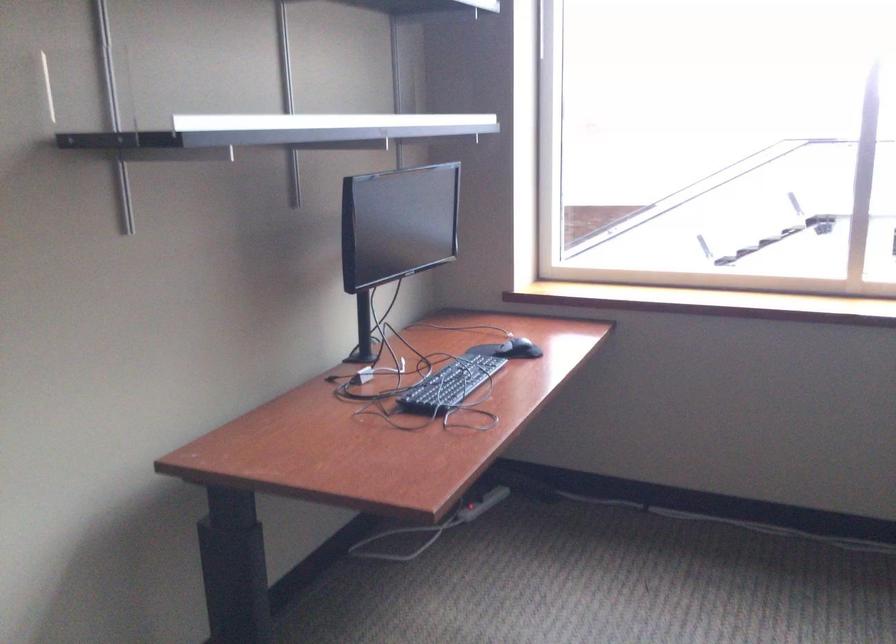
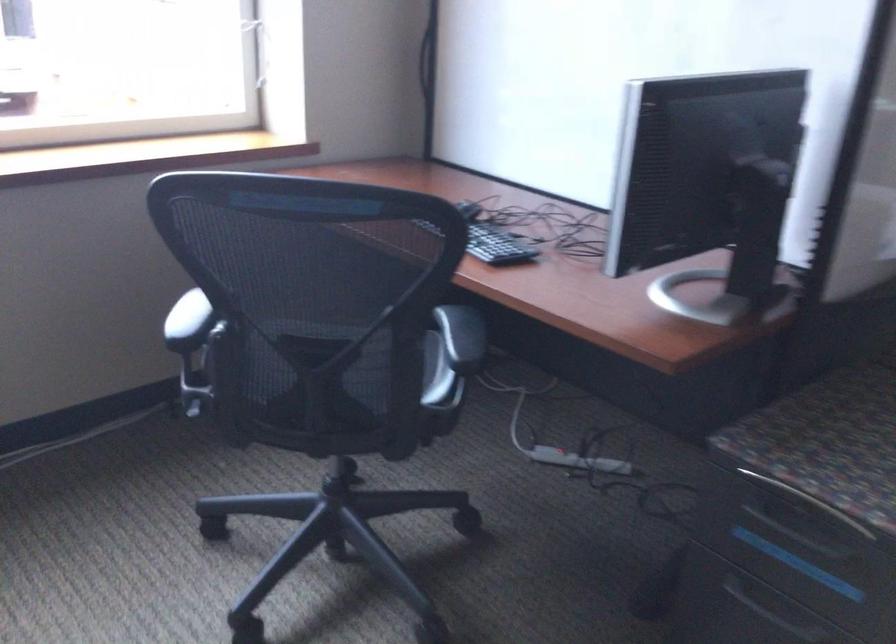
Question: Based on the continuous images, in which direction is the camera rotating? Reply with the corresponding letter.

Choices:
 (A) Left
 (B) Right
 (C) Up
 (D) Down

Answer: (B)